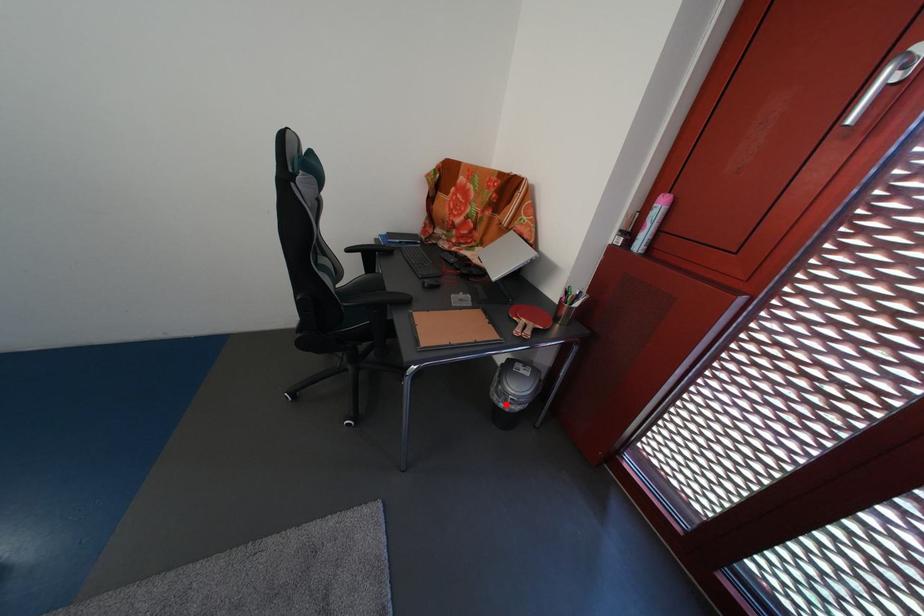
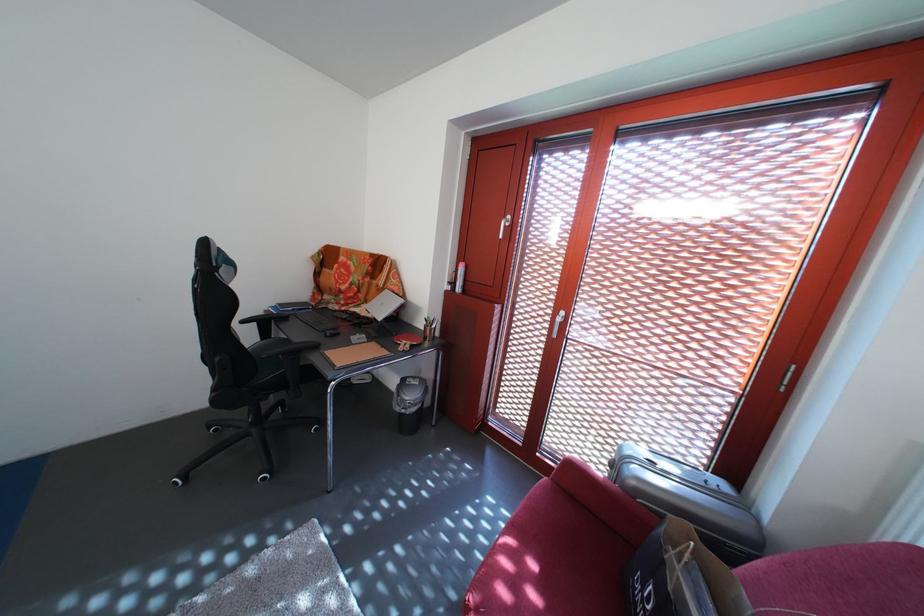
Question: I am providing you with two images of the same scene from different viewpoints. Image1 has a red point marked. In image2, the corresponding 3D location appears at what relative position? Reply with the corresponding letter.

Choices:
 (A) Closer
 (B) Farther

Answer: (B)